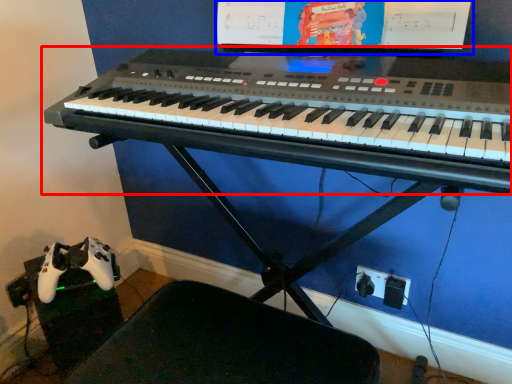
Question: Which object appears farthest to the camera in this image, musical keyboard (highlighted by a red box) or computer monitor (highlighted by a blue box)?

Choices:
 (A) musical keyboard
 (B) computer monitor

Answer: (B)